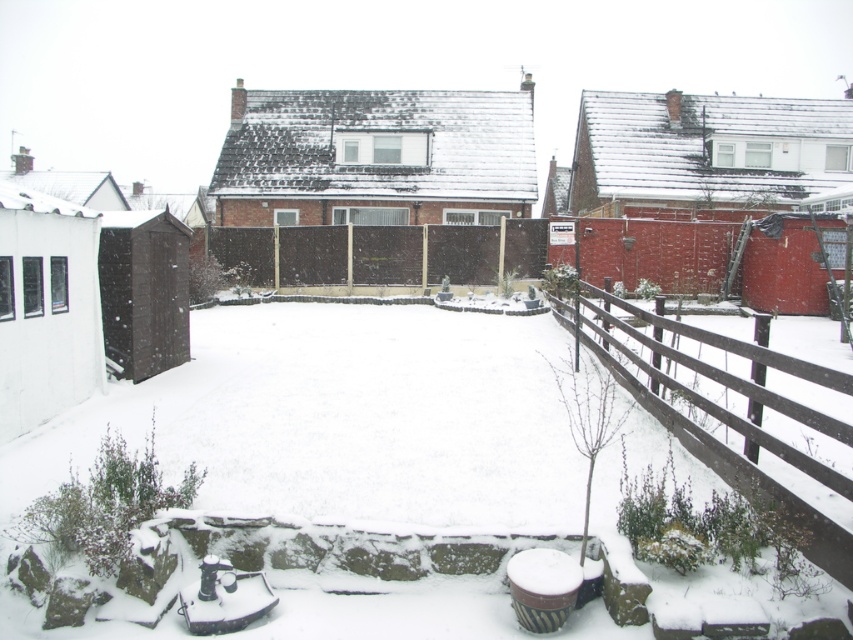
Question: Which point appears farthest from the camera in this image?

Choices:
 (A) (849, 396)
 (B) (335, 227)

Answer: (B)

Question: Which point is farther from the camera taking this photo?

Choices:
 (A) (515, 262)
 (B) (589, 296)

Answer: (A)

Question: Is brown wooden fence at lower right above brown wooden fence at center?

Choices:
 (A) yes
 (B) no

Answer: (B)

Question: Does brown wooden fence at lower right have a greater width compared to brown wooden fence at center?

Choices:
 (A) no
 (B) yes

Answer: (A)

Question: Is brown wooden fence at lower right closer to camera compared to brown wooden fence at center?

Choices:
 (A) yes
 (B) no

Answer: (A)